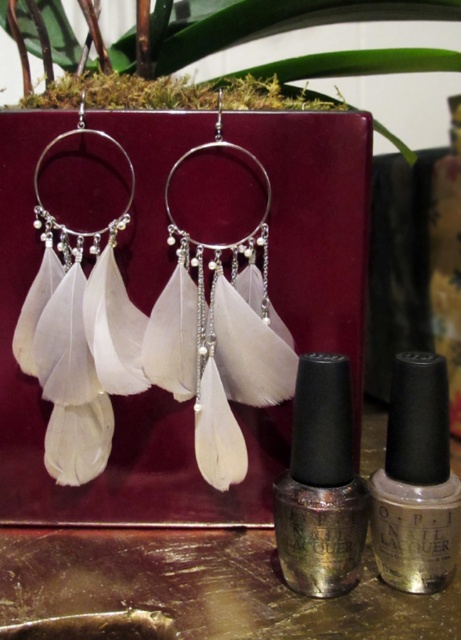
In the scene shown: You are organizing a beauty kit and need to place the metallic silver nail polish at center. Where exactly should you position it relative to the other items in the image?

The metallic silver nail polish at center is located at point (x=320, y=484), so you should position it at those coordinates relative to the other items in the image.

You are holding a metallic silver nail polish at center and want to place it on a shelf that is 50 centimeters away from you. Can you reach the shelf without moving your hand?

The metallic silver nail polish at center is 55.09 centimeters from viewer, so the shelf is 50 centimeters away which is closer than the nail polish. Therefore, you can reach the shelf without moving your hand.